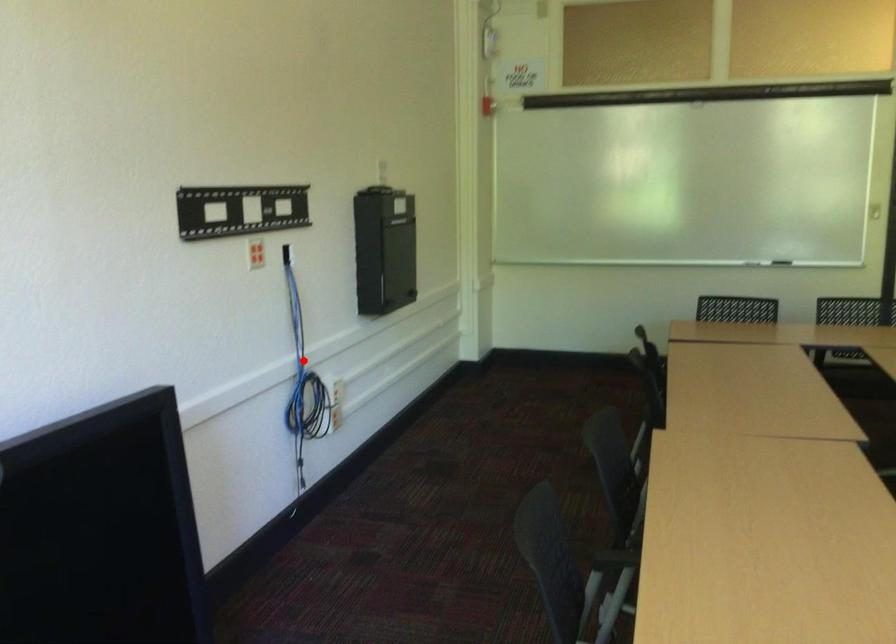
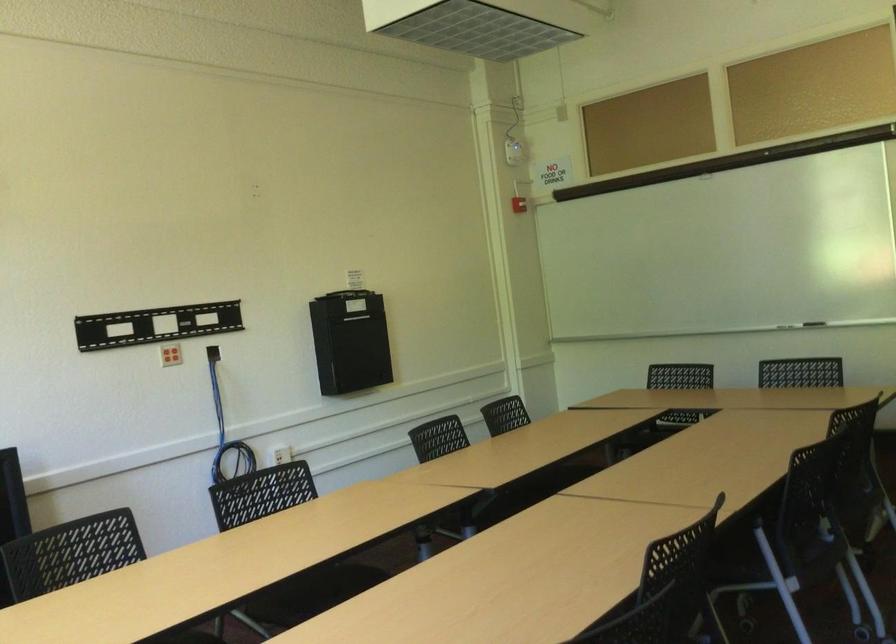
Find the pixel in the second image that matches the highlighted location in the first image.

(226, 431)